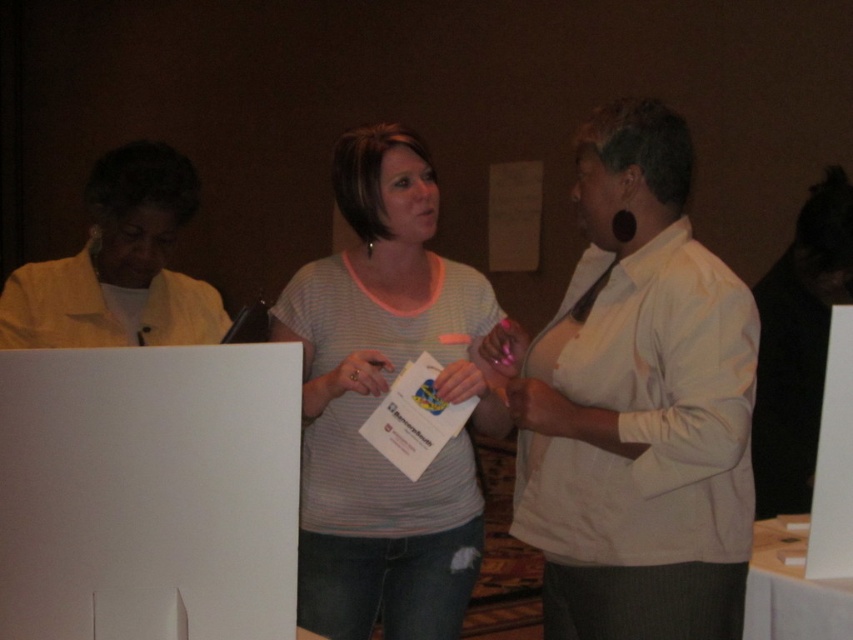
Question: Is white matte shirt at center behind light gray striped shirt at center?

Choices:
 (A) no
 (B) yes

Answer: (A)

Question: Is white matte shirt at center wider than light beige jacket at left?

Choices:
 (A) no
 (B) yes

Answer: (B)

Question: Which point is closer to the camera?

Choices:
 (A) (401, 348)
 (B) (146, 202)

Answer: (B)

Question: Among these objects, which one is nearest to the camera?

Choices:
 (A) light beige jacket at left
 (B) light gray striped shirt at center

Answer: (A)

Question: Which point is farther to the camera?

Choices:
 (A) light beige jacket at left
 (B) light gray striped shirt at center
 (C) white matte shirt at center

Answer: (B)

Question: Can you confirm if light gray striped shirt at center is thinner than light beige jacket at left?

Choices:
 (A) no
 (B) yes

Answer: (A)